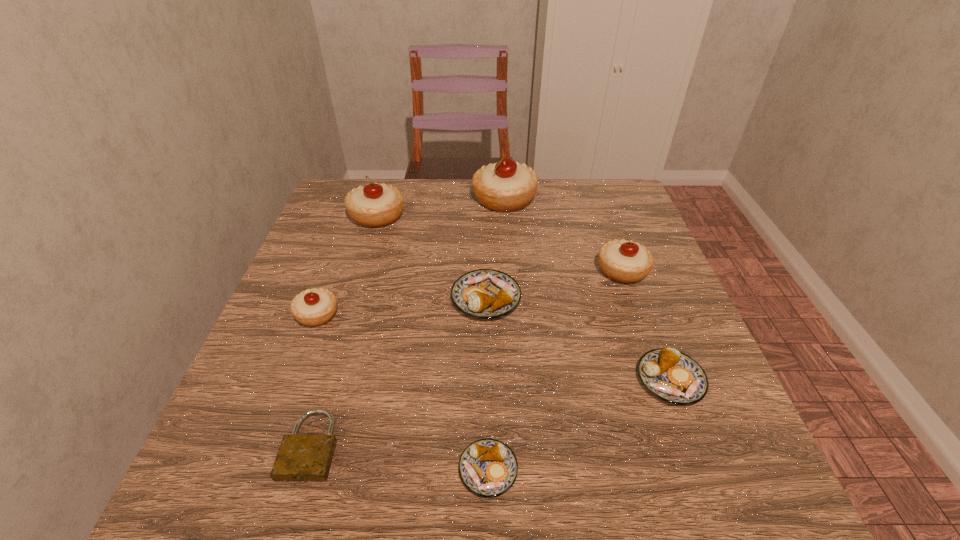
This screenshot has width=960, height=540. Find the location of `the tallest object`. the tallest object is located at coordinates (505, 186).

This screenshot has width=960, height=540. Find the location of `the biggest beige pastry`. the biggest beige pastry is located at coordinates (505, 186).

Where is `the third smallest beige pastry`? This screenshot has height=540, width=960. the third smallest beige pastry is located at coordinates (374, 205).

Where is `the sixth shortest pastry`? The width and height of the screenshot is (960, 540). the sixth shortest pastry is located at coordinates (374, 205).

This screenshot has width=960, height=540. I want to click on the third farthest beige pastry, so click(x=625, y=261).

Where is `the fifth shortest pastry`? The image size is (960, 540). the fifth shortest pastry is located at coordinates (625, 261).

Find the location of a particular element. This screenshot has width=960, height=540. the nearest beige pastry is located at coordinates (313, 307).

The image size is (960, 540). I want to click on the fifth shortest object, so click(313, 307).

The height and width of the screenshot is (540, 960). Identify the location of the fifth tallest pastry. (484, 293).

I want to click on the fifth tallest object, so click(x=484, y=293).